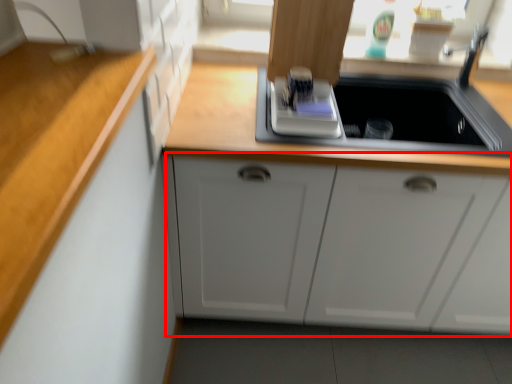
Question: Where is cabinetry (annotated by the red box) located in relation to appliance in the image?

Choices:
 (A) left
 (B) right

Answer: (B)